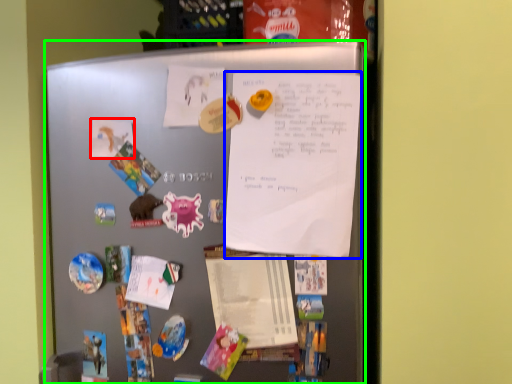
Question: Considering the real-world distances, which object is closest to paper (highlighted by a red box)? poster (highlighted by a blue box) or refrigerator (highlighted by a green box).

Choices:
 (A) poster
 (B) refrigerator

Answer: (B)